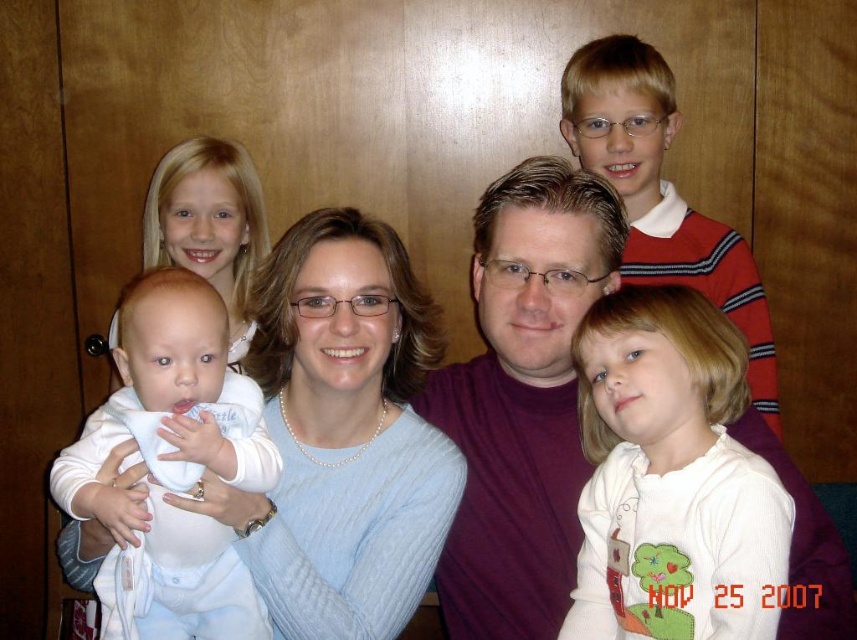
Question: Among these objects, which one is farthest from the camera?

Choices:
 (A) white cable-knit sweater at center
 (B) white soft fabric baby at center
 (C) blonde hair boy at upper right

Answer: (C)

Question: Can you confirm if white cable-knit sweater at center is positioned to the left of white soft shirt at lower right?

Choices:
 (A) no
 (B) yes

Answer: (B)

Question: Does white soft fabric baby at center appear on the left side of blonde hair boy at upper right?

Choices:
 (A) yes
 (B) no

Answer: (A)

Question: Which object appears farthest from the camera in this image?

Choices:
 (A) white cable-knit sweater at center
 (B) blonde hair boy at upper right
 (C) maroon shirt at center
 (D) maroon t-shirt at center

Answer: (B)

Question: Where is white soft shirt at lower right located in relation to blonde hair boy at upper right in the image?

Choices:
 (A) right
 (B) left

Answer: (B)

Question: Which point is closer to the camera?

Choices:
 (A) white cable-knit sweater at center
 (B) white soft shirt at lower right

Answer: (B)